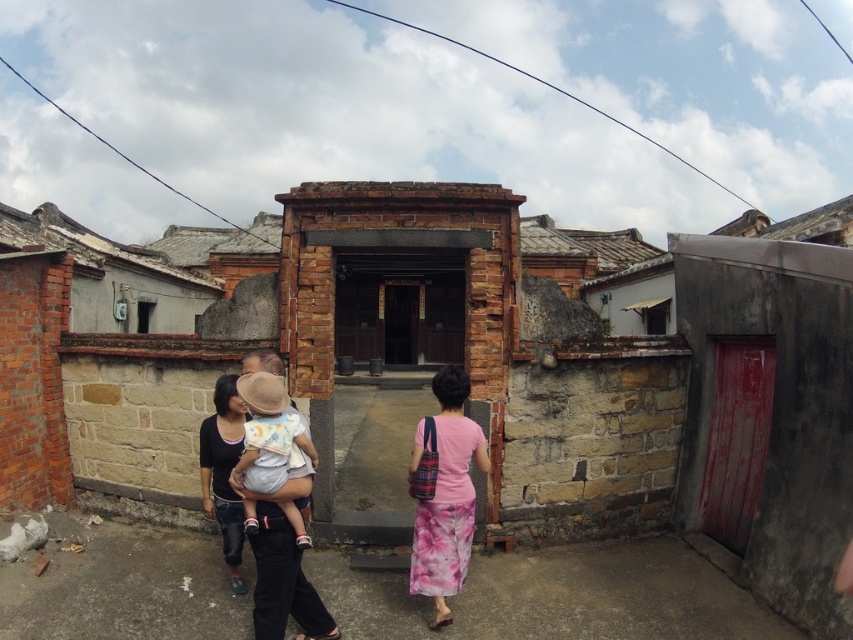
Is point (262, 372) farther from camera compared to point (476, 426)?

No, (262, 372) is in front of (476, 426).

Does point (251, 492) come closer to viewer compared to point (467, 476)?

That is True.

Who is more distant from viewer, (273,490) or (432,525)?

The point (432,525) is more distant.

Locate an element on the screen. matte black shirt at center is located at coordinates (268, 513).

Measure the distance from matte black shirt at center to light beige cotton baby at center.

matte black shirt at center and light beige cotton baby at center are 2.39 inches apart from each other.

Which is above, matte black shirt at center or light beige cotton baby at center?

light beige cotton baby at center is higher up.

Find the location of a particular element. This screenshot has width=853, height=640. matte black shirt at center is located at coordinates (268, 513).

Is pink fabric dress at center positioned at the back of light beige cotton baby at center?

Yes.

Does pink fabric dress at center appear under light beige cotton baby at center?

Indeed, pink fabric dress at center is positioned under light beige cotton baby at center.

Is point (418, 518) behind point (248, 499)?

Yes, point (418, 518) is farther from viewer.

You are a GUI agent. You are given a task and a screenshot of the screen. Output one action in this format:
    pyautogui.click(x=<x>, y=<y>)
    Task: Click on the pink fabric dress at center
    Image resolution: width=853 pixels, height=640 pixels.
    Given the screenshot: What is the action you would take?
    pyautogui.click(x=447, y=499)